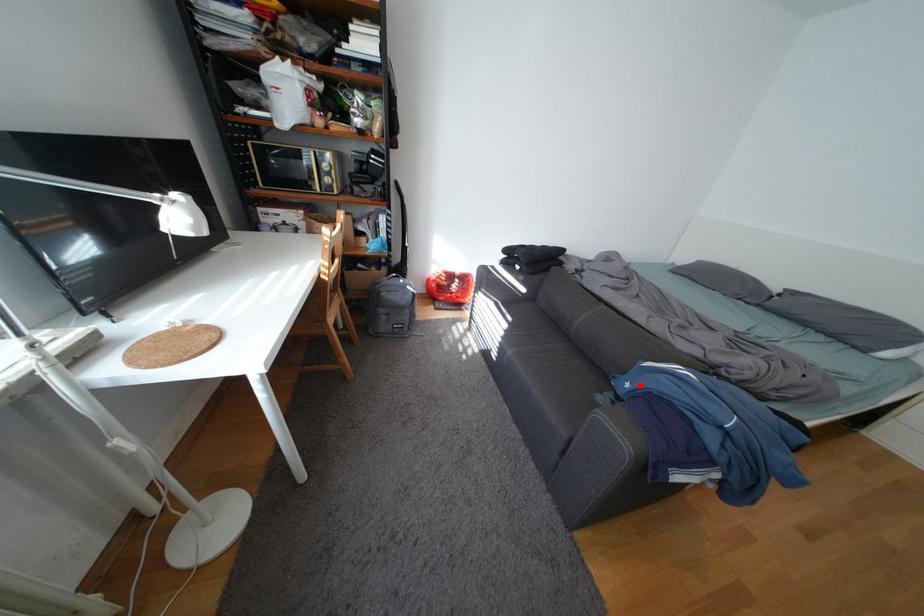
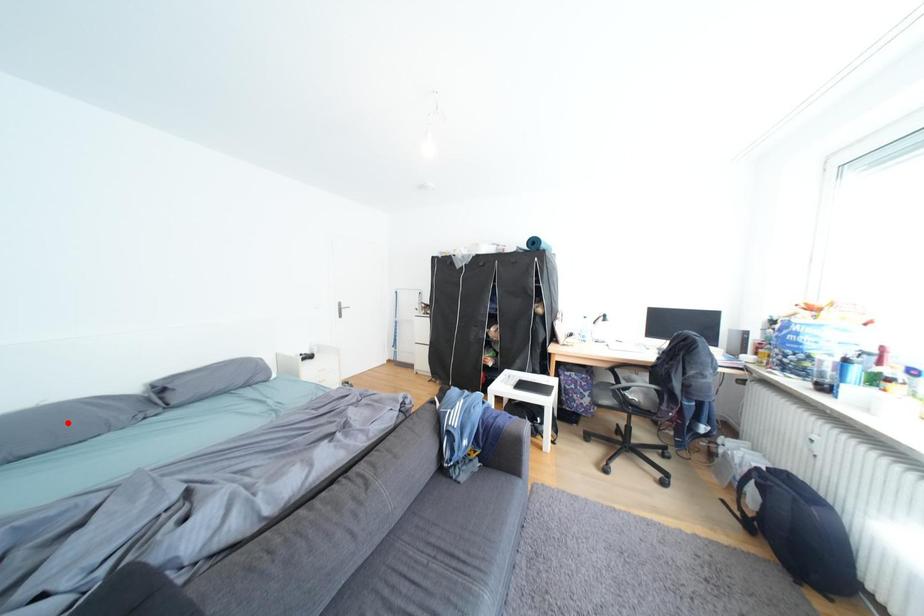
I am providing you with two images of the same scene from different viewpoints. A red point is marked on the first image and another point is marked on the second image. Do the highlighted points in image1 and image2 indicate the same real-world spot?

No